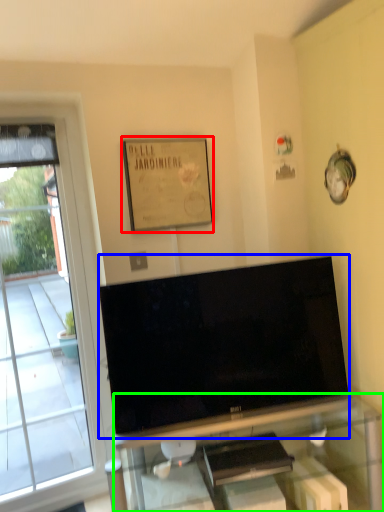
Question: Based on their relative distances, which object is farther from picture frame (highlighted by a red box)? Choose from television (highlighted by a blue box) and furniture (highlighted by a green box).

Choices:
 (A) television
 (B) furniture

Answer: (B)